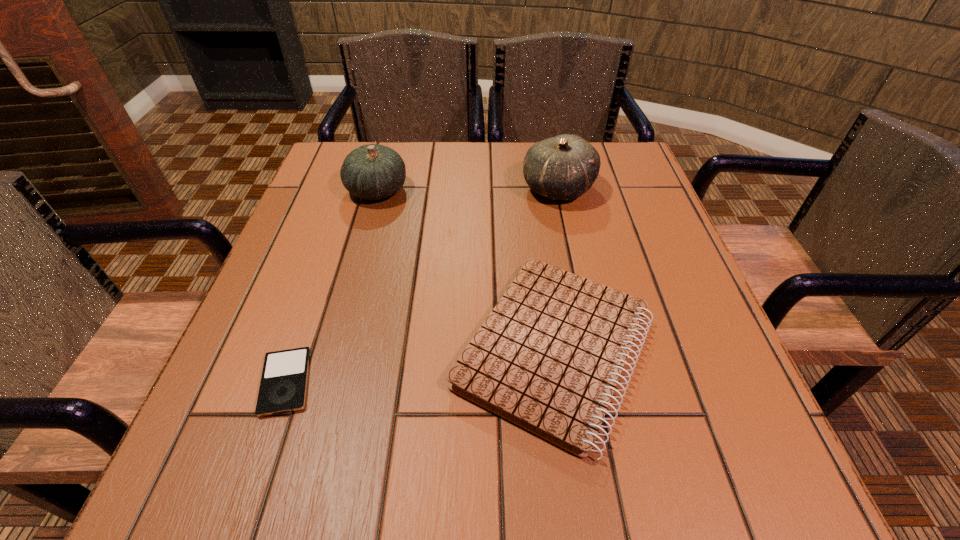
This screenshot has height=540, width=960. Identify the location of iPod located at the left edge. (283, 386).

This screenshot has width=960, height=540. In order to click on gourd present at the right edge in this screenshot , I will do `click(564, 167)`.

Identify the location of notebook that is positioned at the right edge. (548, 358).

You are a GUI agent. You are given a task and a screenshot of the screen. Output one action in this format:
    pyautogui.click(x=<x>, y=<y>)
    Task: Click on the object located in the far left corner section of the desktop
    The image size is (960, 540).
    Given the screenshot: What is the action you would take?
    pyautogui.click(x=372, y=172)

Find the location of `object at the far right corner`. object at the far right corner is located at coordinates coord(564,167).

Where is `object positioned at the near right corner`? object positioned at the near right corner is located at coordinates (548, 358).

Locate an element on the screen. This screenshot has height=540, width=960. vacant point at the far edge is located at coordinates (500, 177).

The height and width of the screenshot is (540, 960). Identify the location of free space at the near edge of the desktop. (612, 462).

In the image, there is a desktop. Where is `free space at the left edge`? free space at the left edge is located at coordinates (283, 288).

Locate an element on the screen. The image size is (960, 540). free space at the right edge of the desktop is located at coordinates (647, 392).